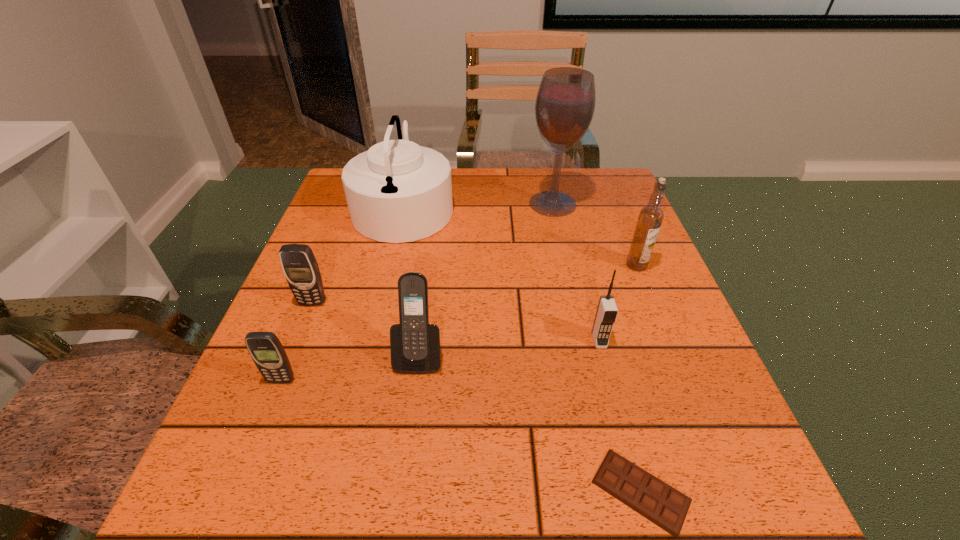
This screenshot has width=960, height=540. What are the coordinates of `the tallest object` in the screenshot? It's located at (565, 103).

Find the location of a particular element. This screenshot has height=540, width=960. kettle is located at coordinates (397, 191).

Identify the location of the third farthest object. The image size is (960, 540). (650, 218).

Locate an element on the screen. The width and height of the screenshot is (960, 540). vodka is located at coordinates (650, 218).

Find the location of a particular element. The height and width of the screenshot is (540, 960). the second cellular telephone from right to left is located at coordinates (414, 343).

Find the location of a particular element. The width and height of the screenshot is (960, 540). the rightmost cellular telephone is located at coordinates (606, 314).

What are the coordinates of `the fifth nearest object` in the screenshot? It's located at (300, 267).

You are a GUI agent. You are given a task and a screenshot of the screen. Output one action in this format:
    pyautogui.click(x=<x>, y=<y>)
    Task: Click on the shortest cellular telephone
    The image size is (960, 540).
    Given the screenshot: What is the action you would take?
    pyautogui.click(x=267, y=352)

Identify the location of the nearest cellular telephone. (267, 352).

This screenshot has width=960, height=540. Find the location of `the nearest object`. the nearest object is located at coordinates (657, 501).